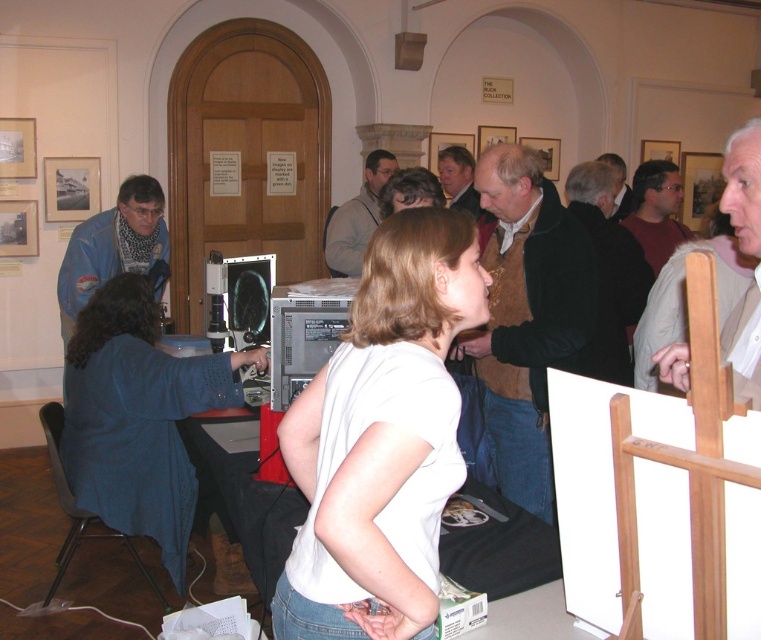
Question: Which point appears closest to the camera in this image?

Choices:
 (A) (169, 540)
 (B) (478, 280)

Answer: (B)

Question: Which of the following is the closest to the observer?

Choices:
 (A) white matte shirt at center
 (B) blue sweater at left

Answer: (A)

Question: Can you confirm if white matte shirt at center is smaller than blue sweater at left?

Choices:
 (A) yes
 (B) no

Answer: (A)

Question: Does white matte shirt at center lie behind blue sweater at left?

Choices:
 (A) no
 (B) yes

Answer: (A)

Question: Does white matte shirt at center have a larger size compared to blue sweater at left?

Choices:
 (A) yes
 (B) no

Answer: (B)

Question: Which point appears closest to the camera in this image?

Choices:
 (A) (304, 628)
 (B) (180, 524)

Answer: (A)